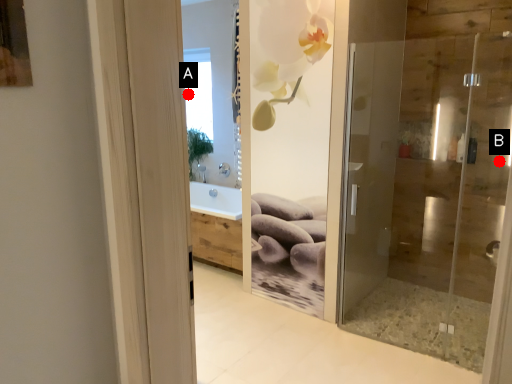
Question: Two points are circled on the image, labeled by A and B beside each circle. Which point is further to the camera?

Choices:
 (A) A is further
 (B) B is further

Answer: (A)